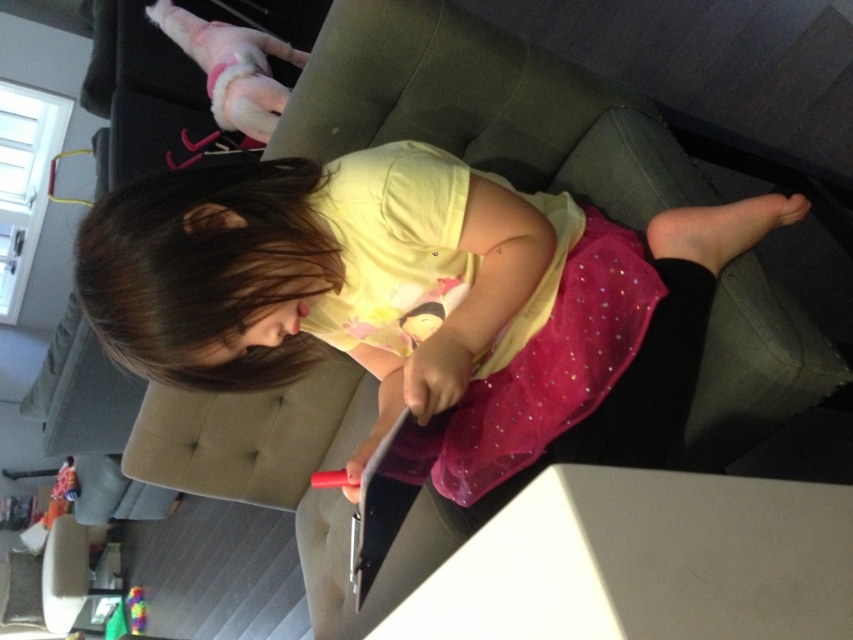
Question: Where is pink tulle skirt at center located in relation to plush pink stuffed animal at upper left in the image?

Choices:
 (A) right
 (B) left

Answer: (A)

Question: Which point is closer to the camera?

Choices:
 (A) plush pink stuffed animal at upper left
 (B) sparkly tulle dress at center
 (C) multicolored plastic toy at lower left
 (D) pink tulle skirt at center

Answer: (D)

Question: Can you confirm if pink tulle skirt at center is thinner than plush pink stuffed animal at upper left?

Choices:
 (A) no
 (B) yes

Answer: (A)

Question: From the image, what is the correct spatial relationship of pink tulle skirt at center in relation to sparkly tulle dress at center?

Choices:
 (A) above
 (B) below

Answer: (B)

Question: Which object is the farthest from the plush pink stuffed animal at upper left?

Choices:
 (A) multicolored plastic toy at lower left
 (B) sparkly tulle dress at center

Answer: (B)

Question: Which object is the closest to the pink tulle skirt at center?

Choices:
 (A) plush pink stuffed animal at upper left
 (B) multicolored plastic toy at lower left
 (C) sparkly tulle dress at center

Answer: (C)